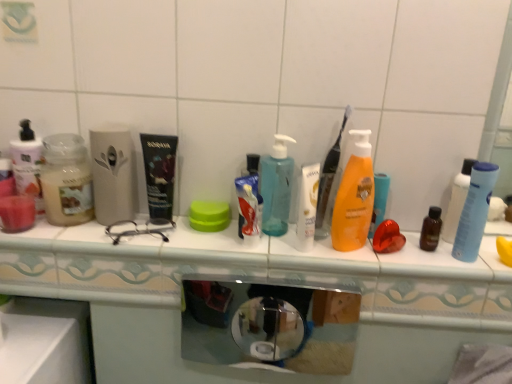
Describe the element at coordinates (159, 174) in the screenshot. I see `dark blue plastic tube at center` at that location.

The height and width of the screenshot is (384, 512). What do you see at coordinates (66, 180) in the screenshot?
I see `matte glass jar at left, the first bottle positioned from the left` at bounding box center [66, 180].

Measure the distance between orange matte lotion at center, the 1th bottle when ordered from right to left, and camera.

orange matte lotion at center, the 1th bottle when ordered from right to left, is 29.80 inches away from camera.

Describe the element at coordinates (209, 216) in the screenshot. I see `green plastic lid at center` at that location.

Image resolution: width=512 pixels, height=384 pixels. Describe the element at coordinates (248, 205) in the screenshot. I see `white glossy toothpaste at center` at that location.

This screenshot has height=384, width=512. What are the coordinates of `blue matte bottle at right` in the screenshot? It's located at (475, 212).

Where is `translucent plastic pump bottle at center, which appears as the 2th bottle when viewed from the right`? translucent plastic pump bottle at center, which appears as the 2th bottle when viewed from the right is located at coordinates (276, 187).

Are orange matte lotion at center, marked as the third bottle in a left-to-right arrangement, and translucent plastic pump bottle at center, which appears as the 2th bottle when viewed from the right, far apart?

No, orange matte lotion at center, marked as the third bottle in a left-to-right arrangement, is in close proximity to translucent plastic pump bottle at center, which appears as the 2th bottle when viewed from the right.

Who is shorter, orange matte lotion at center, marked as the third bottle in a left-to-right arrangement, or translucent plastic pump bottle at center, the 2th bottle viewed from the left?

translucent plastic pump bottle at center, the 2th bottle viewed from the left.

Considering the relative sizes of orange matte lotion at center, marked as the third bottle in a left-to-right arrangement, and translucent plastic pump bottle at center, the 2th bottle viewed from the left, in the image provided, is orange matte lotion at center, marked as the third bottle in a left-to-right arrangement, smaller than translucent plastic pump bottle at center, the 2th bottle viewed from the left,?

Incorrect, orange matte lotion at center, marked as the third bottle in a left-to-right arrangement, is not smaller in size than translucent plastic pump bottle at center, the 2th bottle viewed from the left.

From the image's perspective, which one is positioned lower, orange matte lotion at center, marked as the third bottle in a left-to-right arrangement, or translucent plastic pump bottle at center, which appears as the 2th bottle when viewed from the right?

orange matte lotion at center, marked as the third bottle in a left-to-right arrangement, appears lower in the image.

Is matte glass jar at left, the first bottle positioned from the left, looking in the opposite direction of white glossy lotion at center?

No, matte glass jar at left, the first bottle positioned from the left, is not facing away from white glossy lotion at center.

I want to click on toiletry in front of the matte glass jar at left, acting as the third bottle starting from the right, so 307,207.

In terms of width, does matte glass jar at left, acting as the third bottle starting from the right, look wider or thinner when compared to white glossy lotion at center?

matte glass jar at left, acting as the third bottle starting from the right, is wider than white glossy lotion at center.

Considering the positions of objects matte glass jar at left, acting as the third bottle starting from the right, and white glossy lotion at center in the image provided, who is more to the left, matte glass jar at left, acting as the third bottle starting from the right, or white glossy lotion at center?

→ From the viewer's perspective, matte glass jar at left, acting as the third bottle starting from the right, appears more on the left side.

Do you think blue matte bottle at right is within matte glass jar at left, acting as the third bottle starting from the right, or outside of it?

blue matte bottle at right cannot be found inside matte glass jar at left, acting as the third bottle starting from the right.

Which of these two, blue matte bottle at right or matte glass jar at left, acting as the third bottle starting from the right, stands taller?

blue matte bottle at right.

Does point (478, 185) lie in front of point (61, 184)?

Yes.

Is blue matte bottle at right oriented towards matte glass jar at left, the first bottle positioned from the left?

No, blue matte bottle at right is not facing towards matte glass jar at left, the first bottle positioned from the left.

Can you see dark blue plastic tube at center touching orange matte lotion at center, marked as the third bottle in a left-to-right arrangement?

No, dark blue plastic tube at center is not in contact with orange matte lotion at center, marked as the third bottle in a left-to-right arrangement.

Considering the sizes of objects dark blue plastic tube at center and orange matte lotion at center, the 1th bottle when ordered from right to left, in the image provided, who is wider, dark blue plastic tube at center or orange matte lotion at center, the 1th bottle when ordered from right to left,?

With larger width is dark blue plastic tube at center.

Is matte glass jar at left, acting as the third bottle starting from the right, next to green plastic lid at center?

No, matte glass jar at left, acting as the third bottle starting from the right, is not with green plastic lid at center.

From the image's perspective, between matte glass jar at left, acting as the third bottle starting from the right, and green plastic lid at center, which one is located above?

matte glass jar at left, acting as the third bottle starting from the right, from the image's perspective.

Considering the positions of objects matte glass jar at left, the first bottle positioned from the left, and green plastic lid at center in the image provided, who is behind, matte glass jar at left, the first bottle positioned from the left, or green plastic lid at center?

green plastic lid at center.

Between green plastic lid at center and orange matte lotion at center, the 1th bottle when ordered from right to left, which one has larger width?

Wider between the two is green plastic lid at center.

Considering the relative sizes of green plastic lid at center and orange matte lotion at center, the 1th bottle when ordered from right to left, in the image provided, is green plastic lid at center smaller than orange matte lotion at center, the 1th bottle when ordered from right to left,?

Yes.

Would you say green plastic lid at center is a long distance from orange matte lotion at center, marked as the third bottle in a left-to-right arrangement?

No, green plastic lid at center is not far from orange matte lotion at center, marked as the third bottle in a left-to-right arrangement.

From a real-world perspective, is white glossy lotion at center physically below matte glass jar at left, acting as the third bottle starting from the right?

Yes, from a real-world perspective, white glossy lotion at center is under matte glass jar at left, acting as the third bottle starting from the right.

Could you tell me if white glossy lotion at center is turned towards matte glass jar at left, acting as the third bottle starting from the right?

No.

Between white glossy lotion at center and matte glass jar at left, acting as the third bottle starting from the right, which one has smaller size?

Smaller between the two is white glossy lotion at center.

Is white glossy lotion at center next to matte glass jar at left, the first bottle positioned from the left?

They are not placed beside each other.

What are the coordinates of `the 1st bottle located beneath the orange matte lotion at center, marked as the third bottle in a left-to-right arrangement (from a real-world perspective)` in the screenshot? It's located at (276, 187).

Where is `toiletry that appears in front of the matte glass jar at left, acting as the third bottle starting from the right`? The height and width of the screenshot is (384, 512). toiletry that appears in front of the matte glass jar at left, acting as the third bottle starting from the right is located at coordinates (307, 207).

From the image, which object appears to be farther from dark blue plastic tube at center, green plastic lid at center or orange matte lotion at center, marked as the third bottle in a left-to-right arrangement?

Based on the image, orange matte lotion at center, marked as the third bottle in a left-to-right arrangement, appears to be further to dark blue plastic tube at center.

From the image, which object appears to be farther from white glossy lotion at center, dark blue plastic tube at center or white glossy toothpaste at center?

dark blue plastic tube at center is further to white glossy lotion at center.

From the image, which object appears to be nearer to blue matte bottle at right, matte glass jar at left, acting as the third bottle starting from the right, or white glossy lotion at center?

white glossy lotion at center is closer to blue matte bottle at right.

From the picture: Based on their spatial positions, is translucent plastic pump bottle at center, the 2th bottle viewed from the left, or blue matte bottle at right further from white glossy toothpaste at center?

Based on the image, blue matte bottle at right appears to be further to white glossy toothpaste at center.

Based on their spatial positions, is dark blue plastic tube at center or white glossy toothpaste at center further from green plastic lid at center?

dark blue plastic tube at center.

Looking at this image, looking at the image, which one is located further to translucent plastic pump bottle at center, the 2th bottle viewed from the left, white glossy toothpaste at center or blue matte bottle at right?

blue matte bottle at right lies further to translucent plastic pump bottle at center, the 2th bottle viewed from the left, than the other object.

Estimate the real-world distances between objects in this image. Which object is further from white glossy toothpaste at center, orange matte lotion at center, the 1th bottle when ordered from right to left, or translucent plastic pump bottle at center, the 2th bottle viewed from the left?

orange matte lotion at center, the 1th bottle when ordered from right to left.

Based on their spatial positions, is blue matte bottle at right or orange matte lotion at center, marked as the third bottle in a left-to-right arrangement, further from matte glass jar at left, the first bottle positioned from the left?

blue matte bottle at right is positioned further to the anchor matte glass jar at left, the first bottle positioned from the left.

This screenshot has width=512, height=384. What are the coordinates of `toiletry between matte glass jar at left, acting as the third bottle starting from the right, and blue matte bottle at right, in the horizontal direction` in the screenshot? It's located at (307, 207).

Where is `bottle between white glossy toothpaste at center and white glossy lotion at center from left to right`? The height and width of the screenshot is (384, 512). bottle between white glossy toothpaste at center and white glossy lotion at center from left to right is located at coordinates (276, 187).

This screenshot has width=512, height=384. In order to click on bottle situated between green plastic lid at center and white glossy lotion at center from left to right in this screenshot , I will do `click(276, 187)`.

This screenshot has width=512, height=384. I want to click on toothpaste located between green plastic lid at center and blue matte bottle at right in the left-right direction, so click(x=248, y=205).